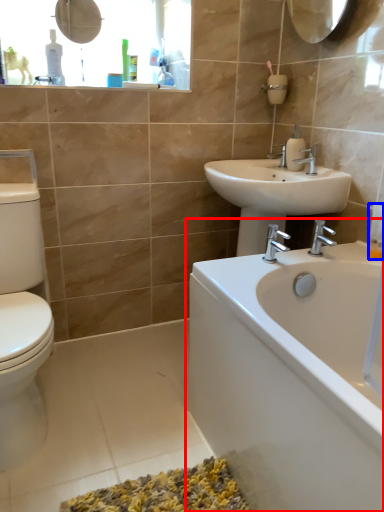
Question: Which object appears closest to the camera in this image, bathtub (highlighted by a red box) or toiletry (highlighted by a blue box)?

Choices:
 (A) bathtub
 (B) toiletry

Answer: (A)